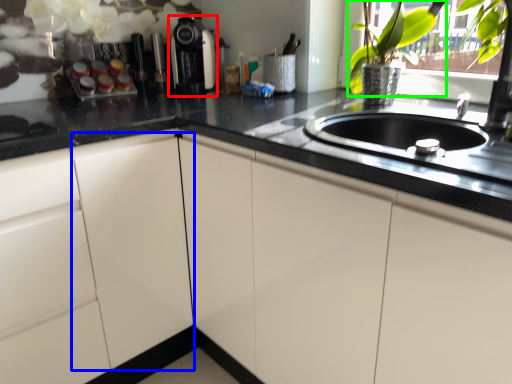
Question: Which object is the closest to the coffee machine (highlighted by a red box)? Choose among these: cabinetry (highlighted by a blue box) or floral arrangement (highlighted by a green box).

Choices:
 (A) cabinetry
 (B) floral arrangement

Answer: (B)